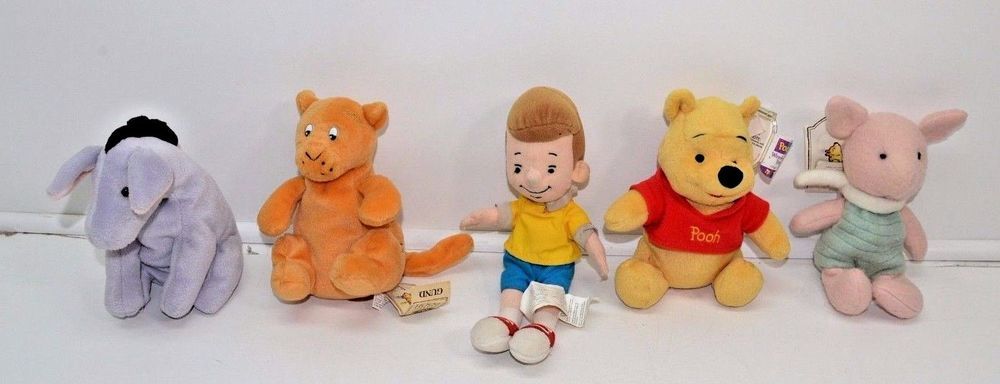
In order to click on stuffed animals in this screenshot , I will do `click(900, 164)`, `click(702, 172)`, `click(544, 165)`, `click(335, 205)`, `click(156, 198)`.